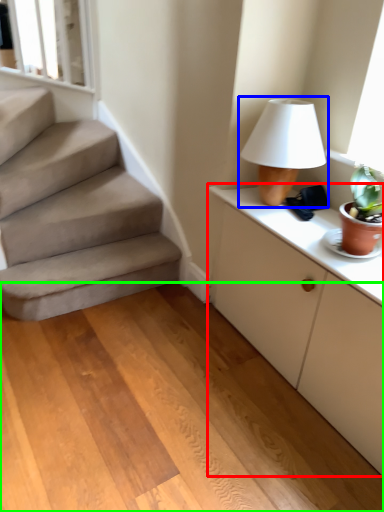
Question: Which object is the closest to the cabinetry (highlighted by a red box)? Choose among these: table lamp (highlighted by a blue box) or concrete (highlighted by a green box).

Choices:
 (A) table lamp
 (B) concrete

Answer: (A)